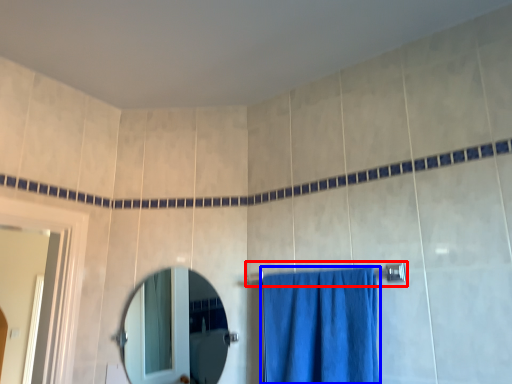
Question: Which point is further to the camera, towel bar (highlighted by a red box) or curtain (highlighted by a blue box)?

Choices:
 (A) towel bar
 (B) curtain

Answer: (A)